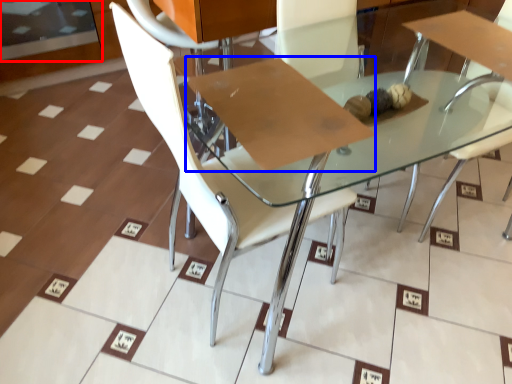
Question: Which object is further to the camera taking this photo, glass door (highlighted by a red box) or cardboard (highlighted by a blue box)?

Choices:
 (A) glass door
 (B) cardboard

Answer: (A)